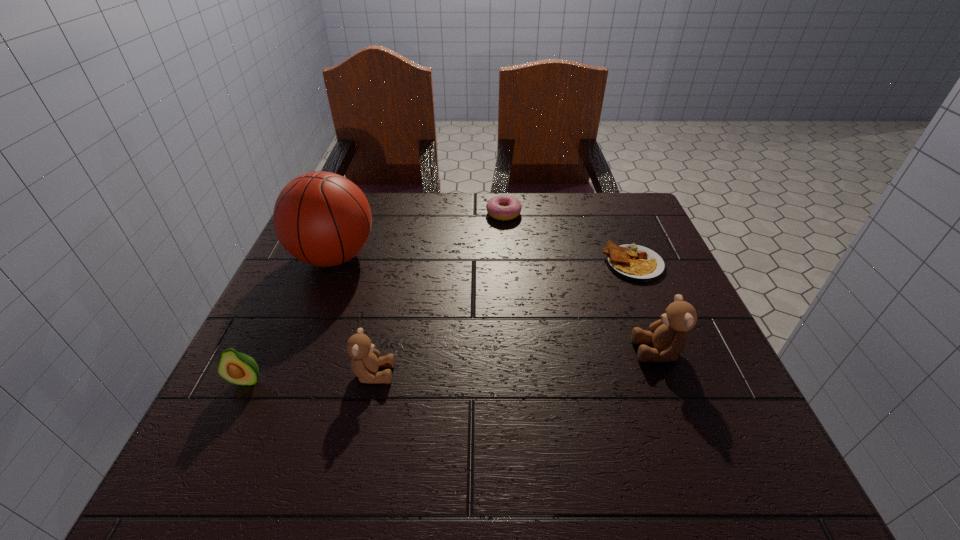
This screenshot has height=540, width=960. I want to click on vacant space at the far right corner of the desktop, so click(x=638, y=199).

The height and width of the screenshot is (540, 960). I want to click on vacant space at the near right corner of the desktop, so click(x=693, y=421).

The width and height of the screenshot is (960, 540). Identify the location of free space that is in between the avocado and the basketball. click(x=291, y=319).

This screenshot has height=540, width=960. Identify the location of free spot between the right teddy bear and the omelet. (646, 307).

At what (x,y) coordinates should I click in order to perform the action: click on free point between the right teddy bear and the left teddy bear. Please return your answer as a coordinate pair (x, y). Looking at the image, I should click on (516, 362).

Locate an element on the screen. free space between the taller teddy bear and the omelet is located at coordinates (646, 307).

You are a GUI agent. You are given a task and a screenshot of the screen. Output one action in this format:
    pyautogui.click(x=<x>, y=<y>)
    Task: Click on the free spot between the avocado and the third object from left to right
    This screenshot has width=960, height=540.
    Given the screenshot: What is the action you would take?
    pyautogui.click(x=310, y=377)

This screenshot has height=540, width=960. Identify the location of unoccupied area between the avocado and the right teddy bear. (452, 366).

Locate an element on the screen. unoccupied area between the omelet and the right teddy bear is located at coordinates (646, 307).

What are the coordinates of `unoccupied position between the basketball and the avocado` in the screenshot? It's located at (291, 319).